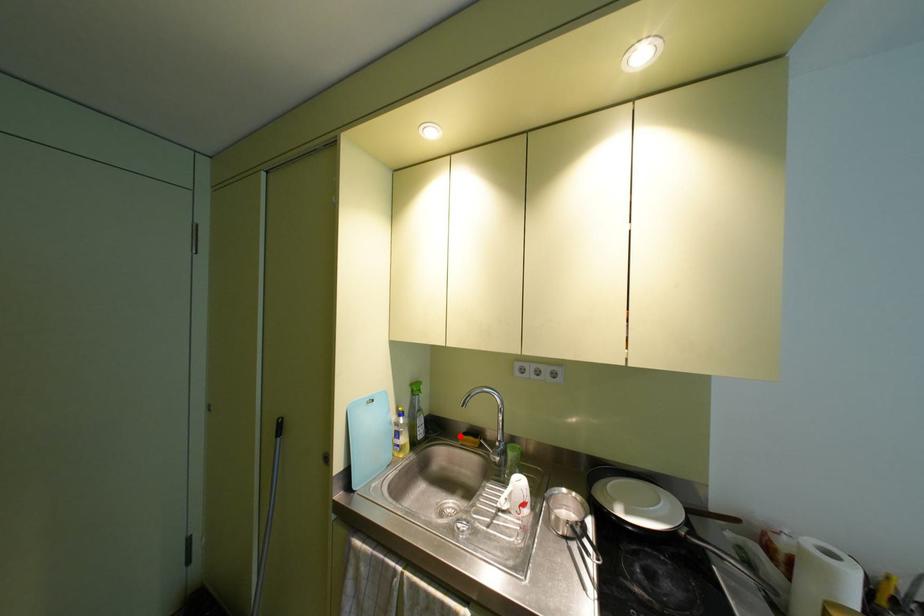
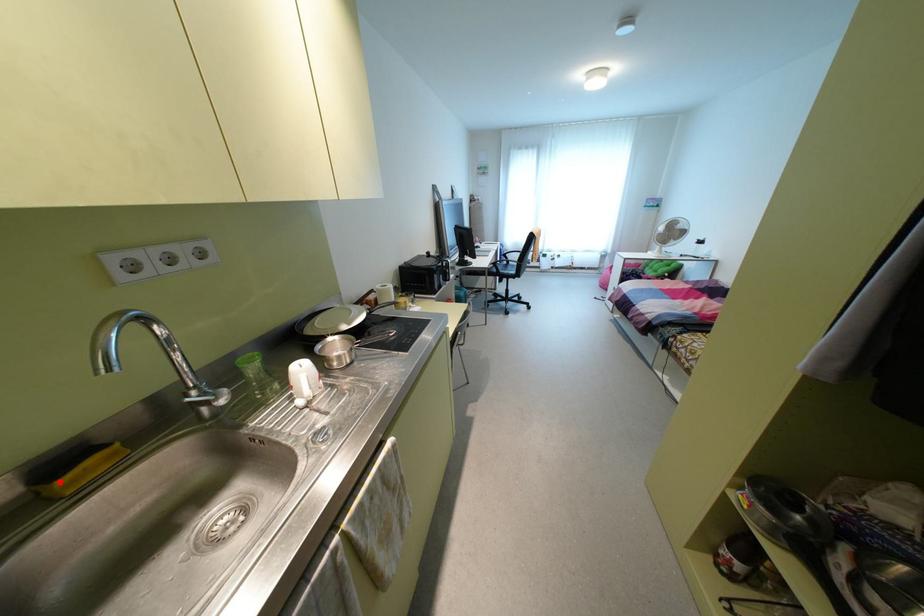
I am providing you with two images of the same scene from different viewpoints. A red point is marked on the first image and another point is marked on the second image. Is the marked point in image1 the same physical position as the marked point in image2?

Yes